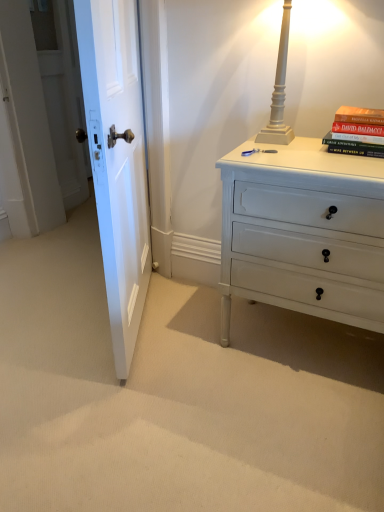
Question: Considering the positions of white painted wood chest of drawers at right and white painted wood table lamp at upper right in the image, is white painted wood chest of drawers at right taller or shorter than white painted wood table lamp at upper right?

Choices:
 (A) short
 (B) tall

Answer: (B)

Question: Is point (311, 181) positioned closer to the camera than point (291, 70)?

Choices:
 (A) farther
 (B) closer

Answer: (B)

Question: Estimate the real-world distances between objects in this image. Which object is farther from the white painted wood table lamp at upper right?

Choices:
 (A) white wooden door at left
 (B) hardcover book at upper right
 (C) white painted wood chest of drawers at right

Answer: (A)

Question: Estimate the real-world distances between objects in this image. Which object is farther from the white wooden door at left?

Choices:
 (A) hardcover book at upper right
 (B) white painted wood chest of drawers at right
 (C) white painted wood table lamp at upper right

Answer: (A)